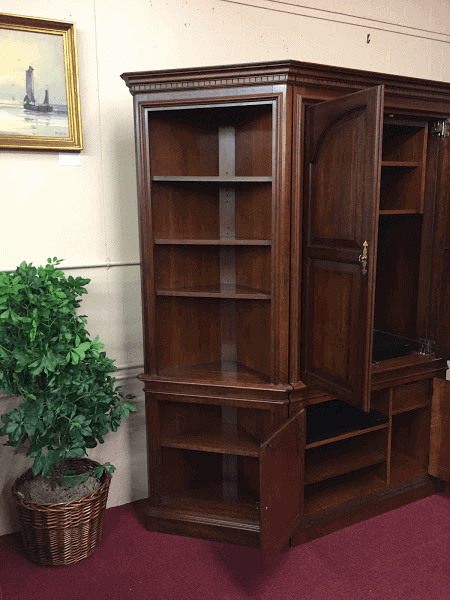
The width and height of the screenshot is (450, 600). I want to click on handle, so click(365, 261).